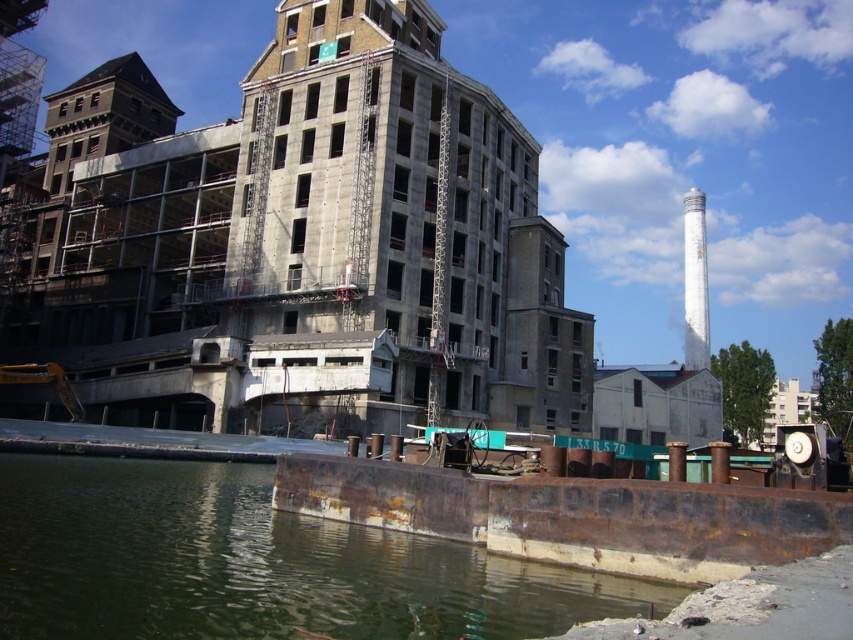
Question: Does rusty metal river at lower left lie behind white painted concrete tower at upper right?

Choices:
 (A) no
 (B) yes

Answer: (A)

Question: Can you confirm if rusty metal river at lower left is bigger than white painted concrete tower at upper right?

Choices:
 (A) no
 (B) yes

Answer: (A)

Question: Is rusty metal river at lower left to the left of white painted concrete tower at upper right from the viewer's perspective?

Choices:
 (A) no
 (B) yes

Answer: (B)

Question: Among these objects, which one is farthest from the camera?

Choices:
 (A) rusty metal river at lower left
 (B) white painted concrete tower at upper right

Answer: (B)